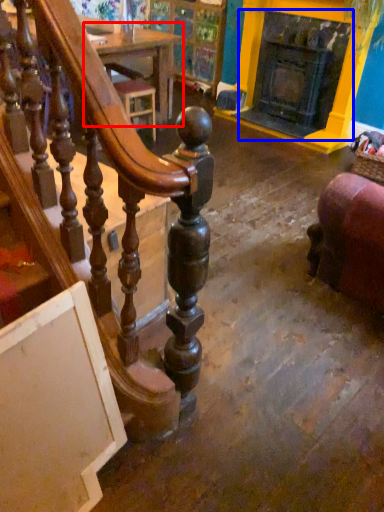
Question: Which object appears farthest to the camera in this image, table (highlighted by a red box) or fireplace (highlighted by a blue box)?

Choices:
 (A) table
 (B) fireplace

Answer: (A)